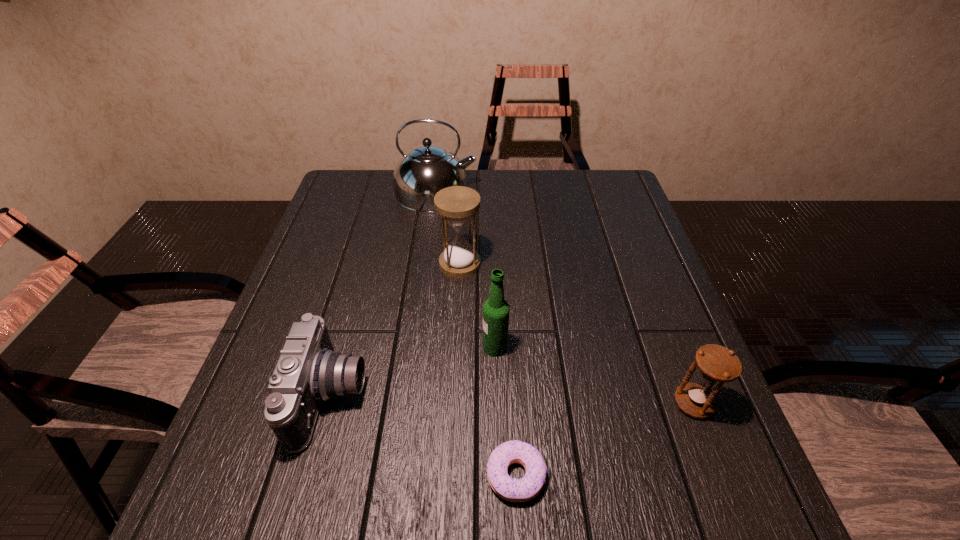
Locate an element on the screen. the farthest object is located at coordinates (426, 169).

You are a GUI agent. You are given a task and a screenshot of the screen. Output one action in this format:
    pyautogui.click(x=<x>, y=<y>)
    Task: Click on the beer bottle
    The width and height of the screenshot is (960, 540).
    Given the screenshot: What is the action you would take?
    pyautogui.click(x=496, y=309)

In order to click on the taller hourglass in this screenshot , I will do `click(457, 205)`.

Find the location of a particular element. The height and width of the screenshot is (540, 960). the left hourglass is located at coordinates (457, 205).

This screenshot has width=960, height=540. Find the location of `camera`. camera is located at coordinates (308, 372).

Find the location of a particular element. This screenshot has height=540, width=960. the rightmost object is located at coordinates (716, 363).

Where is `the shorter hourglass`? The height and width of the screenshot is (540, 960). the shorter hourglass is located at coordinates pyautogui.click(x=716, y=363).

What are the coordinates of `doughnut` in the screenshot? It's located at (528, 487).

This screenshot has width=960, height=540. I want to click on vacant space located 0.330m from the spout of the kettle, so click(581, 191).

Where is `free space located 0.360m on the label of the beer bottle`? The width and height of the screenshot is (960, 540). free space located 0.360m on the label of the beer bottle is located at coordinates (317, 347).